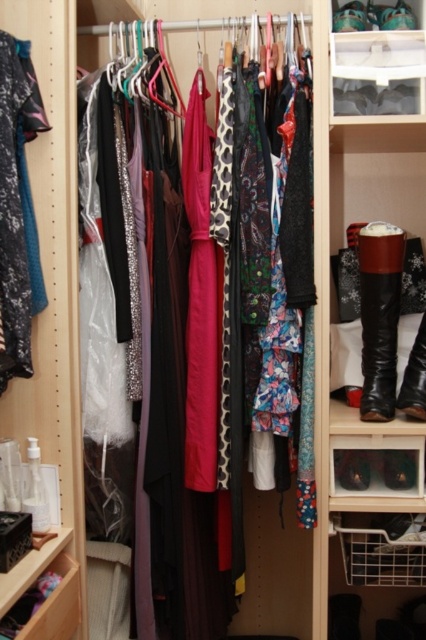
Does clear plastic shoebox at upper center appear on the left side of leather boots at right?

Yes, clear plastic shoebox at upper center is to the left of leather boots at right.

The image size is (426, 640). What do you see at coordinates (377, 60) in the screenshot? I see `clear plastic shoebox at upper center` at bounding box center [377, 60].

You are a GUI agent. You are given a task and a screenshot of the screen. Output one action in this format:
    pyautogui.click(x=<x>, y=<y>)
    Task: Click on the clear plastic shoebox at upper center
    
    Given the screenshot: What is the action you would take?
    pyautogui.click(x=377, y=60)

How much distance is there between velvet teal dress at left and brushed metal drawer at lower left?

velvet teal dress at left and brushed metal drawer at lower left are 52.50 centimeters apart.

Is velvet teal dress at left above brushed metal drawer at lower left?

Indeed, velvet teal dress at left is positioned over brushed metal drawer at lower left.

What do you see at coordinates (17, 208) in the screenshot?
I see `velvet teal dress at left` at bounding box center [17, 208].

The image size is (426, 640). I want to click on velvet teal dress at left, so click(x=17, y=208).

From the picture: Can you confirm if velvet teal dress at left is positioned to the left of shiny black leather boot at right?

Indeed, velvet teal dress at left is positioned on the left side of shiny black leather boot at right.

Image resolution: width=426 pixels, height=640 pixels. Identify the location of velvet teal dress at left. (17, 208).

What are the coordinates of `velvet teal dress at left` in the screenshot? It's located at (17, 208).